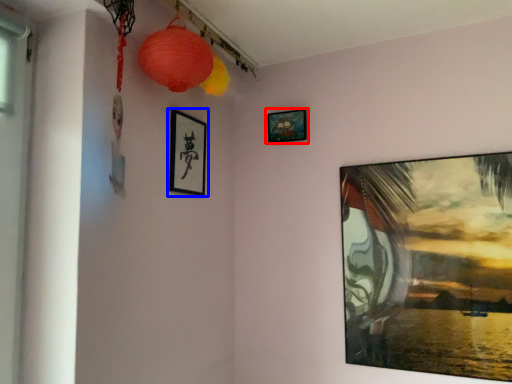
Question: Which object is further to the camera taking this photo, picture frame (highlighted by a red box) or picture frame (highlighted by a blue box)?

Choices:
 (A) picture frame
 (B) picture frame

Answer: (A)